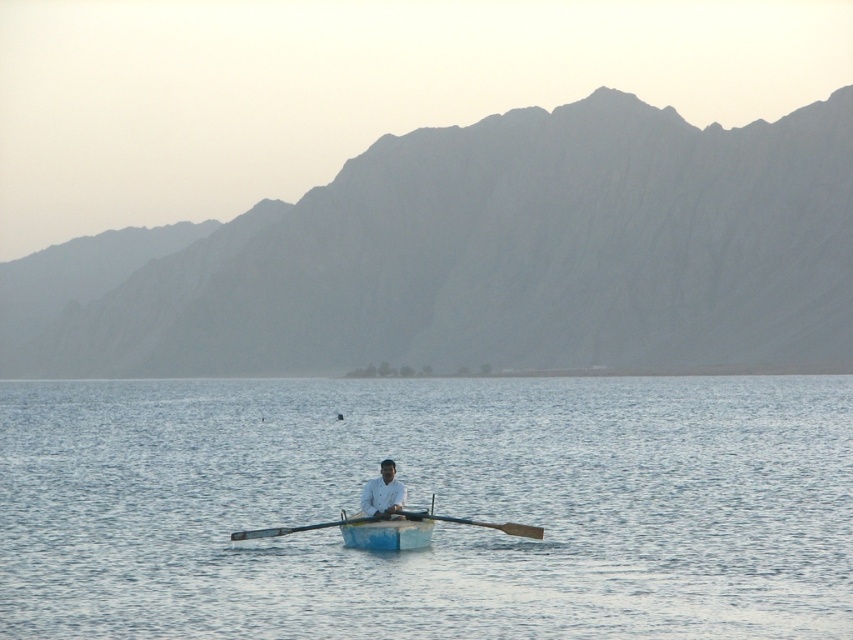
Is blue water at center bigger than wooden smooth paddle at center?

Yes, blue water at center is bigger than wooden smooth paddle at center.

Is point (193, 381) closer to camera compared to point (521, 525)?

No, it is not.

Identify the location of blue water at center. The image size is (853, 640). (427, 506).

Is blue painted wood canoe at center further to camera compared to wooden smooth paddle at center?

No, blue painted wood canoe at center is in front of wooden smooth paddle at center.

Who is positioned more to the left, blue painted wood canoe at center or wooden smooth paddle at center?

blue painted wood canoe at center is more to the left.

At what (x,y) coordinates should I click in order to perform the action: click on blue painted wood canoe at center. Please return your answer as a coordinate pair (x, y). Looking at the image, I should click on (387, 532).

Find the location of a particular element. This screenshot has height=640, width=853. blue painted wood canoe at center is located at coordinates (387, 532).

Does blue water at center have a larger size compared to gray rock mountain at upper center?

No.

Which is behind, point (222, 426) or point (254, 269)?

Point (254, 269)

You are a GUI agent. You are given a task and a screenshot of the screen. Output one action in this format:
    pyautogui.click(x=<x>, y=<y>)
    Task: Click on the blue water at center
    The height and width of the screenshot is (640, 853).
    Given the screenshot: What is the action you would take?
    pyautogui.click(x=427, y=506)